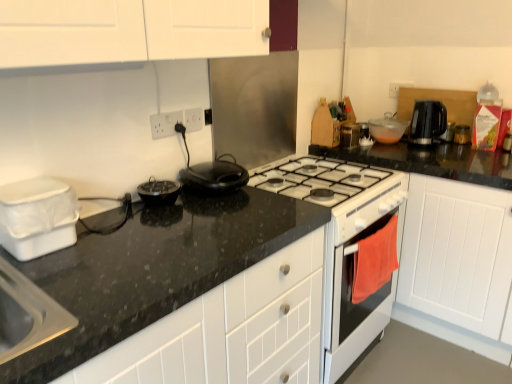
In order to click on space that is in front of black matte waffle maker at center, acting as the 2th kitchen appliance starting from the front in this screenshot , I will do `click(154, 223)`.